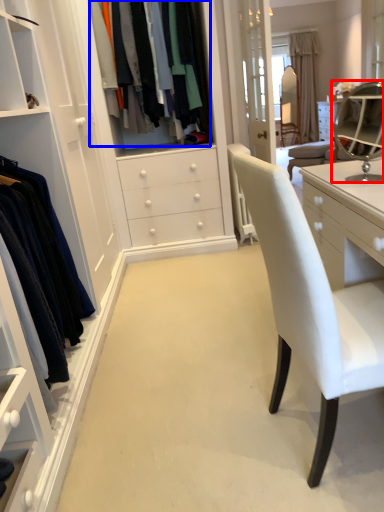
Question: Which point is further to the camera, mirror (highlighted by a red box) or clothing (highlighted by a blue box)?

Choices:
 (A) mirror
 (B) clothing

Answer: (B)